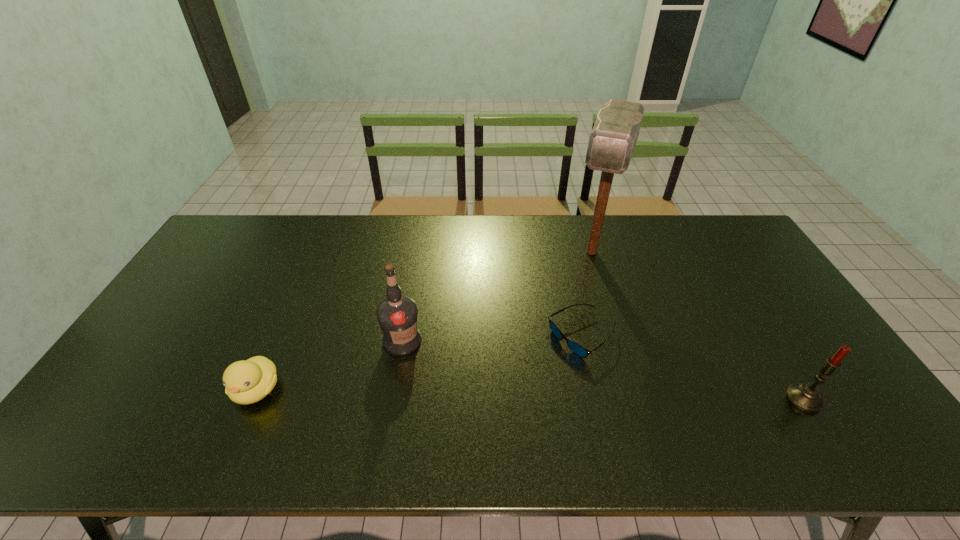
At what (x,y) coordinates should I click in order to perform the action: click on free spot on the desktop that is between the duckling and the rightmost object and is positioned on the striking face of the farthest object. Please return your answer as a coordinate pair (x, y). Looking at the image, I should click on (541, 395).

The width and height of the screenshot is (960, 540). In order to click on vacant space on the desktop that is between the fourth tallest object and the rightmost object and is positioned on the front label of the fourth object from right to left in this screenshot , I will do `click(476, 394)`.

The image size is (960, 540). Find the location of `free space on the desktop that is between the duckling and the rightmost object and is positioned at the front of the sunglasses showing the lenses`. free space on the desktop that is between the duckling and the rightmost object and is positioned at the front of the sunglasses showing the lenses is located at coordinates (570, 395).